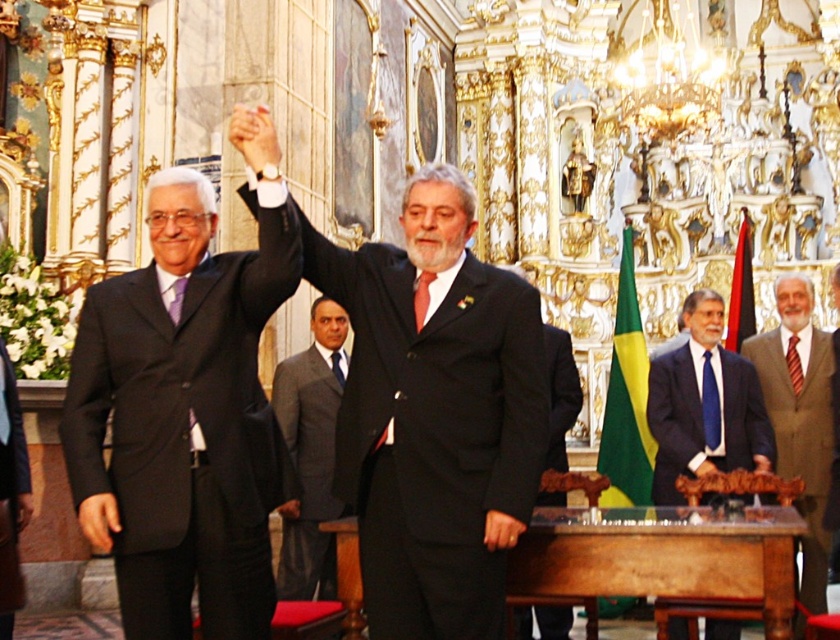
Question: Which object is positioned closest to the black matte suit at center?

Choices:
 (A) blue silk suit at center
 (B) matte black suit at left
 (C) brown wool suit at right

Answer: (B)

Question: Considering the real-world distances, which object is closest to the matte black suit at left?

Choices:
 (A) wooden altar at center
 (B) black matte suit at center
 (C) brown wool suit at right
 (D) smooth brown leather chair at right

Answer: (B)

Question: Which object is positioned closest to the brown wool suit at right?

Choices:
 (A) smooth brown leather chair at right
 (B) blue silk suit at center
 (C) matte black suit at left

Answer: (A)

Question: Can you confirm if wooden altar at center is smaller than smooth brown leather chair at right?

Choices:
 (A) no
 (B) yes

Answer: (B)

Question: Is brown wool suit at right wider than smooth brown leather chair at right?

Choices:
 (A) yes
 (B) no

Answer: (B)

Question: Does gray wool suit at center appear under smooth brown leather chair at right?

Choices:
 (A) no
 (B) yes

Answer: (B)